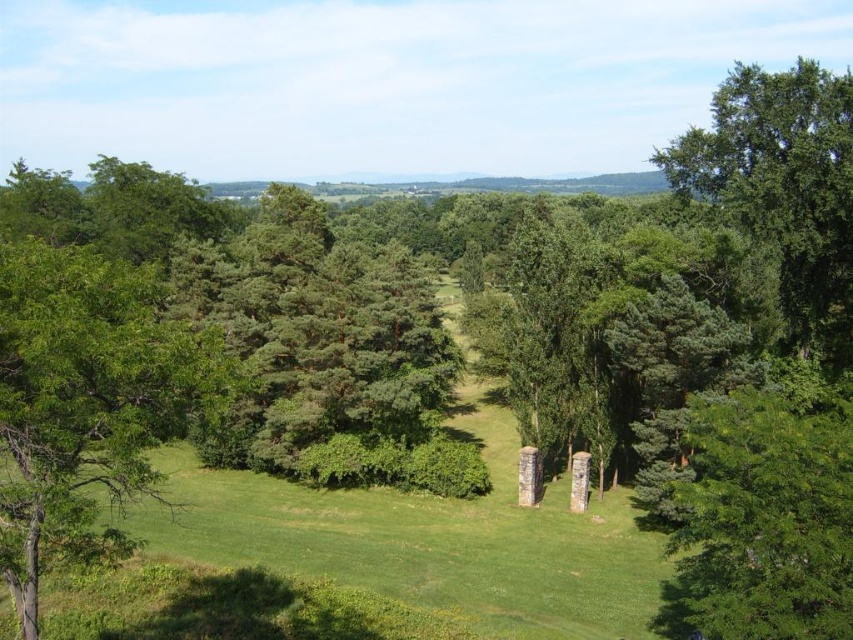
Image resolution: width=853 pixels, height=640 pixels. Identify the location of green leafy tree at lower right. (769, 518).

Is point (752, 605) closer to viewer compared to point (579, 488)?

Yes, it is.

The height and width of the screenshot is (640, 853). Describe the element at coordinates (769, 518) in the screenshot. I see `green leafy tree at lower right` at that location.

Where is `green leafy tree at lower right`? green leafy tree at lower right is located at coordinates (769, 518).

Is smooth stone pillar at center in front of stone column at center?

No, smooth stone pillar at center is further to the viewer.

Between point (519, 470) and point (573, 499), which one is positioned behind?

The point (519, 470) is behind.

Is point (520, 502) positioned in front of point (585, 481)?

No, (520, 502) is behind (585, 481).

Find the location of `smooth stone pillar at center`. smooth stone pillar at center is located at coordinates coord(529,476).

Is green leafy tree at left above green leafy tree at upper right?

No.

Consider the image. Who is shorter, green leafy tree at left or green leafy tree at upper right?

green leafy tree at left

Between point (90, 403) and point (695, 163), which one is positioned in front?

Positioned in front is point (90, 403).

Find the location of a particular element. Image resolution: width=853 pixels, height=640 pixels. green leafy tree at left is located at coordinates (86, 401).